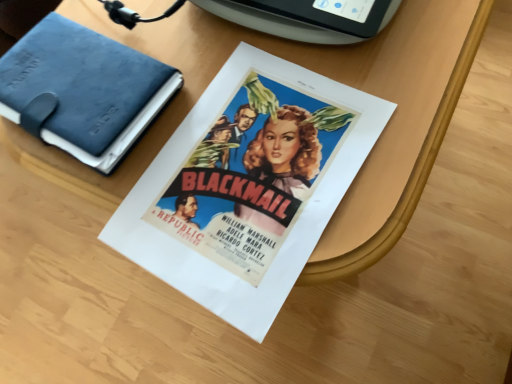
This screenshot has height=384, width=512. Identify the location of empty space that is ontop of matte blue notebook at upper left. (68, 83).